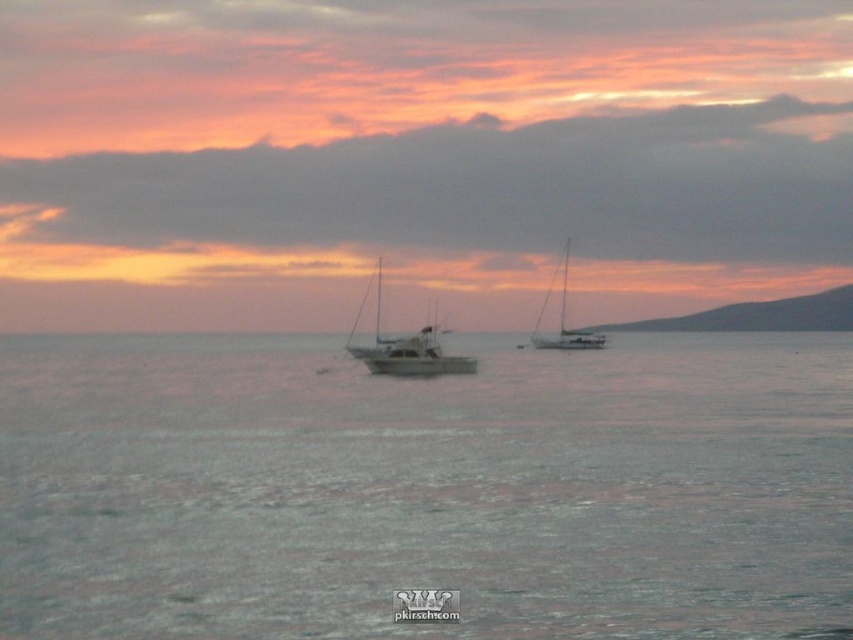
Can you confirm if gray matte water at center is positioned to the right of white matte sailboat at center?

Indeed, gray matte water at center is positioned on the right side of white matte sailboat at center.

The height and width of the screenshot is (640, 853). I want to click on gray matte water at center, so click(x=425, y=488).

Is gray matte water at center wider than metallic silver sailboat at center?

Yes, gray matte water at center is wider than metallic silver sailboat at center.

Is gray matte water at center to the right of metallic silver sailboat at center from the viewer's perspective?

No, gray matte water at center is not to the right of metallic silver sailboat at center.

Between point (56, 442) and point (537, 332), which one is positioned behind?

The point (537, 332) is behind.

What are the coordinates of `gray matte water at center` in the screenshot? It's located at (425, 488).

Can you confirm if white matte sailboat at center is wider than metallic silver sailboat at center?

Correct, the width of white matte sailboat at center exceeds that of metallic silver sailboat at center.

Is white matte sailboat at center shorter than metallic silver sailboat at center?

Yes, white matte sailboat at center is shorter than metallic silver sailboat at center.

Is point (424, 348) positioned after point (532, 346)?

No, it is in front of (532, 346).

This screenshot has height=640, width=853. Find the location of `white matte sailboat at center`. white matte sailboat at center is located at coordinates (405, 348).